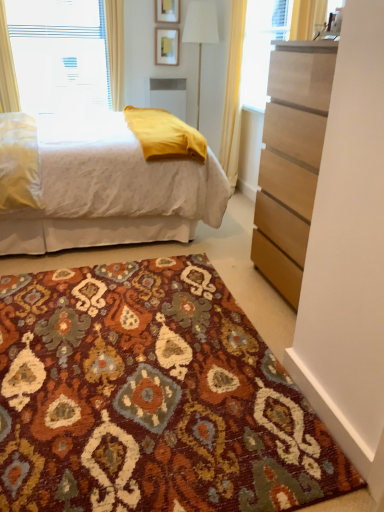
Question: From the image's perspective, does wooden picture frame at upper center, positioned as the 1th picture frame in top-to-bottom order, appear lower than white plastic window at upper left?

Choices:
 (A) no
 (B) yes

Answer: (A)

Question: Is wooden picture frame at upper center, placed as the second picture frame when sorted from bottom to top, next to white plastic window at upper left and touching it?

Choices:
 (A) no
 (B) yes

Answer: (A)

Question: From the image's perspective, is wooden picture frame at upper center, positioned as the 1th picture frame in top-to-bottom order, located above white plastic window at upper left?

Choices:
 (A) no
 (B) yes

Answer: (B)

Question: Does wooden picture frame at upper center, positioned as the 1th picture frame in top-to-bottom order, have a smaller size compared to white plastic window at upper left?

Choices:
 (A) no
 (B) yes

Answer: (B)

Question: Is wooden picture frame at upper center, placed as the second picture frame when sorted from bottom to top, positioned with its back to white plastic window at upper left?

Choices:
 (A) yes
 (B) no

Answer: (B)

Question: From the image's perspective, relative to white sheer curtain at upper left, which is the 2th curtain from right to left, is light brown wood chest of drawers at right above or below?

Choices:
 (A) below
 (B) above

Answer: (A)

Question: Considering the positions of point (291, 223) and point (6, 44), is point (291, 223) closer or farther from the camera than point (6, 44)?

Choices:
 (A) closer
 (B) farther

Answer: (A)

Question: In the image, is light brown wood chest of drawers at right on the left side or the right side of white sheer curtain at upper left, which is the 2th curtain from right to left?

Choices:
 (A) left
 (B) right

Answer: (B)

Question: From a real-world perspective, is light brown wood chest of drawers at right positioned above or below white sheer curtain at upper left, which is the 2th curtain from right to left?

Choices:
 (A) below
 (B) above

Answer: (A)

Question: Looking at the image, does white sheer curtain at upper left, the first curtain from the left, seem bigger or smaller compared to wooden picture frame at upper center, placed as the second picture frame when sorted from bottom to top?

Choices:
 (A) big
 (B) small

Answer: (A)

Question: From a real-world perspective, is white sheer curtain at upper left, the first curtain from the left, physically located above or below wooden picture frame at upper center, placed as the second picture frame when sorted from bottom to top?

Choices:
 (A) above
 (B) below

Answer: (B)

Question: Looking at their shapes, would you say white sheer curtain at upper left, the first curtain from the left, is wider or thinner than wooden picture frame at upper center, placed as the second picture frame when sorted from bottom to top?

Choices:
 (A) thin
 (B) wide

Answer: (B)

Question: Relative to wooden picture frame at upper center, positioned as the 1th picture frame in top-to-bottom order, is white sheer curtain at upper left, the first curtain from the left, in front or behind?

Choices:
 (A) front
 (B) behind

Answer: (A)

Question: Would you say white plastic window at upper left is to the left or to the right of white fabric lampshade at center in the picture?

Choices:
 (A) right
 (B) left

Answer: (B)

Question: Based on their sizes in the image, would you say white plastic window at upper left is bigger or smaller than white fabric lampshade at center?

Choices:
 (A) small
 (B) big

Answer: (A)